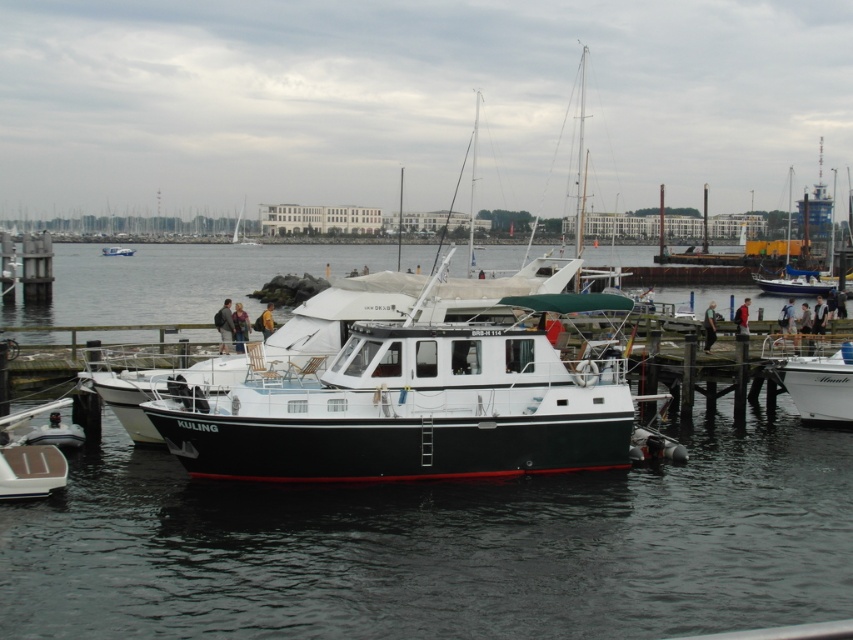
Question: Does white glossy boat at right have a greater width compared to white glossy boat at center?

Choices:
 (A) no
 (B) yes

Answer: (A)

Question: Which point is closer to the camera taking this photo?

Choices:
 (A) (535, 492)
 (B) (115, 244)
 (C) (813, 408)

Answer: (A)

Question: Which point is farther to the camera?

Choices:
 (A) (119, 252)
 (B) (65, 310)
 (C) (822, 403)

Answer: (A)

Question: Is white glossy boat at right bigger than white glossy boat at center?

Choices:
 (A) no
 (B) yes

Answer: (A)

Question: Which point appears closest to the camera in this image?

Choices:
 (A) (103, 256)
 (B) (790, 368)

Answer: (B)

Question: Is black glossy water at center bigger than white glossy boat at center?

Choices:
 (A) yes
 (B) no

Answer: (A)